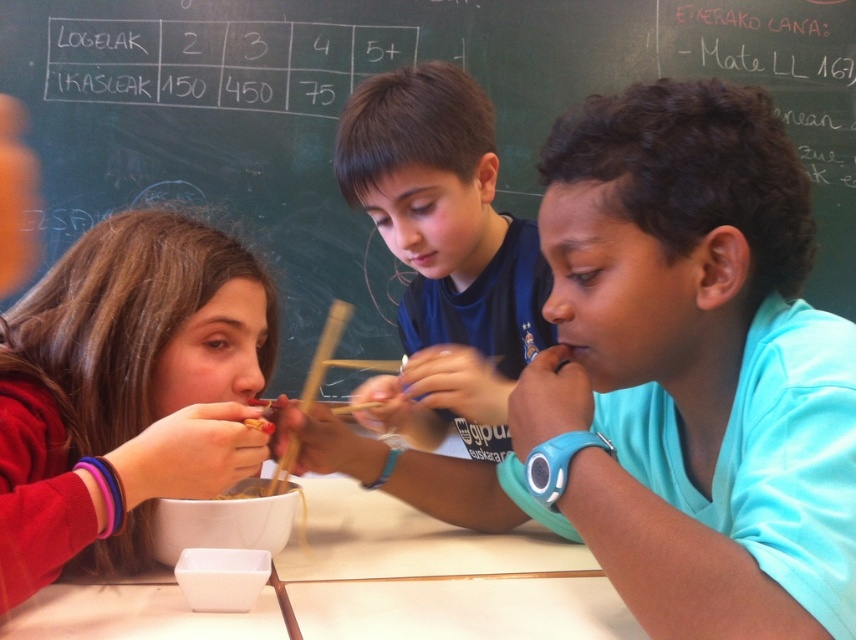
You are a teacher standing in front of the classroom. You notice the black chalkboard at upper center and the matte red sweater at left. Which object is positioned to the right of the other?

The black chalkboard at upper center is to the right of the matte red sweater at left.

You are a teacher observing the classroom and notice the matte red sweater at left and the dark blue shirt at center. Which student is closer to the front of the classroom?

The matte red sweater at left is in front of the dark blue shirt at center, so the student wearing the matte red sweater at left is closer to the front of the classroom.